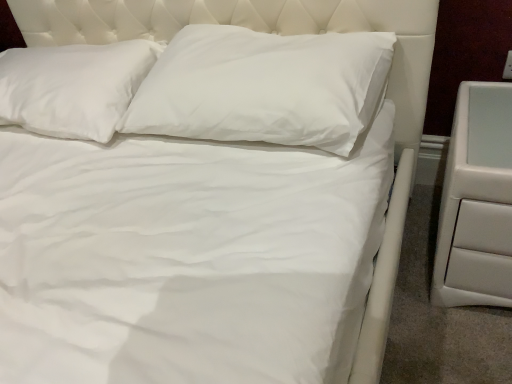
Question: Is white soft pillow at upper center, the 2th pillow in the right-to-left sequence, shorter than white leather nightstand at right?

Choices:
 (A) no
 (B) yes

Answer: (B)

Question: Is white leather nightstand at right inside white soft pillow at upper center, the 2th pillow in the right-to-left sequence?

Choices:
 (A) no
 (B) yes

Answer: (A)

Question: From the image's perspective, is white soft pillow at upper center, the 1th pillow when ordered from left to right, beneath white leather nightstand at right?

Choices:
 (A) no
 (B) yes

Answer: (A)

Question: From a real-world perspective, is white soft pillow at upper center, the 2th pillow in the right-to-left sequence, positioned under white leather nightstand at right based on gravity?

Choices:
 (A) no
 (B) yes

Answer: (A)

Question: Is white soft pillow at upper center, the 1th pillow when ordered from left to right, positioned far away from white leather nightstand at right?

Choices:
 (A) yes
 (B) no

Answer: (A)

Question: From a real-world perspective, is white leather nightstand at right physically located above or below white soft pillow at upper center, the 1th pillow when ordered from left to right?

Choices:
 (A) above
 (B) below

Answer: (B)

Question: Looking at the image, does white leather nightstand at right seem bigger or smaller compared to white soft pillow at upper center, the 1th pillow when ordered from left to right?

Choices:
 (A) small
 (B) big

Answer: (A)

Question: Considering their positions, is white leather nightstand at right located in front of or behind white soft pillow at upper center, the 1th pillow when ordered from left to right?

Choices:
 (A) behind
 (B) front

Answer: (B)

Question: From the image's perspective, is white leather nightstand at right positioned above or below white soft pillow at upper center, the 2th pillow in the right-to-left sequence?

Choices:
 (A) above
 (B) below

Answer: (B)

Question: Looking at their shapes, would you say white soft pillow at upper center, the 2th pillow in the right-to-left sequence, is wider or thinner than white smooth pillow at center, which is the 1th pillow from right to left?

Choices:
 (A) wide
 (B) thin

Answer: (A)

Question: Choose the correct answer: Is white soft pillow at upper center, the 2th pillow in the right-to-left sequence, inside white smooth pillow at center, positioned as the second pillow in left-to-right order, or outside it?

Choices:
 (A) inside
 (B) outside

Answer: (B)

Question: From their relative heights in the image, would you say white soft pillow at upper center, the 1th pillow when ordered from left to right, is taller or shorter than white smooth pillow at center, which is the 1th pillow from right to left?

Choices:
 (A) tall
 (B) short

Answer: (B)

Question: Does point (138, 44) appear closer or farther from the camera than point (158, 62)?

Choices:
 (A) closer
 (B) farther

Answer: (B)

Question: Considering the positions of white smooth pillow at center, positioned as the second pillow in left-to-right order, and white leather nightstand at right in the image, is white smooth pillow at center, positioned as the second pillow in left-to-right order, wider or thinner than white leather nightstand at right?

Choices:
 (A) thin
 (B) wide

Answer: (A)

Question: Do you think white smooth pillow at center, which is the 1th pillow from right to left, is within white leather nightstand at right, or outside of it?

Choices:
 (A) inside
 (B) outside

Answer: (B)